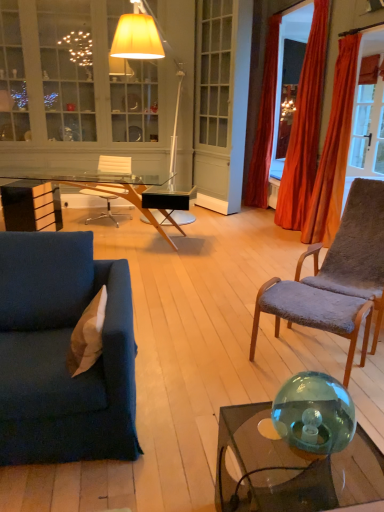
The height and width of the screenshot is (512, 384). Describe the element at coordinates (368, 124) in the screenshot. I see `translucent glass door at upper right` at that location.

The width and height of the screenshot is (384, 512). Describe the element at coordinates (264, 122) in the screenshot. I see `velvet orange curtain at right, positioned as the first curtain in back-to-front order` at that location.

This screenshot has height=512, width=384. In order to click on orange velvet curtain at right, the 3th curtain from the back in this screenshot , I will do `click(334, 150)`.

Can you tell me how much translucent glass door at upper right and orange velvet curtain at right, which is the first curtain in front-to-back order, differ in facing direction?

The angular difference between translucent glass door at upper right and orange velvet curtain at right, which is the first curtain in front-to-back order, is 87.9 degrees.

Looking at this image, between translucent glass door at upper right and orange velvet curtain at right, which is the first curtain in front-to-back order, which one is positioned in front?

orange velvet curtain at right, which is the first curtain in front-to-back order, is closer to the camera.

Considering the sizes of translucent glass door at upper right and orange velvet curtain at right, the 3th curtain from the back, in the image, is translucent glass door at upper right wider or thinner than orange velvet curtain at right, the 3th curtain from the back,?

Clearly, translucent glass door at upper right has less width compared to orange velvet curtain at right, the 3th curtain from the back.

Is orange velvet curtain at right, the 3th curtain from the back, inside translucent glass door at upper right?

That's incorrect, orange velvet curtain at right, the 3th curtain from the back, is not inside translucent glass door at upper right.

From a real-world perspective, is transparent glass desk at center positioned under transparent glass coffee table at lower right based on gravity?

No.

Visually, is transparent glass desk at center positioned to the left or to the right of transparent glass coffee table at lower right?

In the image, transparent glass desk at center appears on the left side of transparent glass coffee table at lower right.

Considering the points (180, 228) and (219, 485), which point is behind, point (180, 228) or point (219, 485)?

The point (180, 228) is more distant.

From the image's perspective, between tan suede pillow at left and clear plastic chair at center, the first chair when ordered from left to right, which one is located above?

clear plastic chair at center, the first chair when ordered from left to right, from the image's perspective.

In the image, is tan suede pillow at left positioned in front of or behind clear plastic chair at center, the second chair from the right?

Clearly, tan suede pillow at left is in front of clear plastic chair at center, the second chair from the right.

Locate an element on the screen. This screenshot has height=512, width=384. chair that is the 2nd one when counting upward from the tan suede pillow at left (from the image's perspective) is located at coordinates (115, 164).

Considering the sizes of objects orange velvet curtain at right, the 3th curtain from the back, and matte white floor lamp at upper center in the image provided, who is shorter, orange velvet curtain at right, the 3th curtain from the back, or matte white floor lamp at upper center?

orange velvet curtain at right, the 3th curtain from the back, is shorter.

Is orange velvet curtain at right, the 3th curtain from the back, wider than matte white floor lamp at upper center?

No.

Which is in front, point (336, 229) or point (177, 98)?

The point (336, 229) is more forward.

Measure the distance between orange velvet curtain at right, the 3th curtain from the back, and matte white floor lamp at upper center.

orange velvet curtain at right, the 3th curtain from the back, and matte white floor lamp at upper center are 2.19 meters apart.

Which object is thinner, transparent glass coffee table at lower right or velvet orange curtain at right, positioned as the first curtain in back-to-front order?

velvet orange curtain at right, positioned as the first curtain in back-to-front order, is thinner.

Which point is more forward, (358,447) or (276,29)?

The point (358,447) is more forward.

Is transparent glass coffee table at lower right touching velvet orange curtain at right, marked as the third curtain in a front-to-back arrangement?

No, transparent glass coffee table at lower right is not making contact with velvet orange curtain at right, marked as the third curtain in a front-to-back arrangement.

Which of these two, transparent glass coffee table at lower right or velvet orange curtain at right, marked as the third curtain in a front-to-back arrangement, is smaller?

With smaller size is transparent glass coffee table at lower right.

Is clear plastic chair at center, the second chair ordered from the bottom, positioned in front of velvet orange curtain at right, positioned as the first curtain in back-to-front order?

Yes, the depth of clear plastic chair at center, the second chair ordered from the bottom, is less than that of velvet orange curtain at right, positioned as the first curtain in back-to-front order.

Can you confirm if clear plastic chair at center, which is the first chair in back-to-front order, is positioned to the right of velvet orange curtain at right, marked as the third curtain in a front-to-back arrangement?

In fact, clear plastic chair at center, which is the first chair in back-to-front order, is to the left of velvet orange curtain at right, marked as the third curtain in a front-to-back arrangement.

What's the angular difference between clear plastic chair at center, the first chair when ordered from left to right, and velvet orange curtain at right, marked as the third curtain in a front-to-back arrangement,'s facing directions?

The angle between the facing direction of clear plastic chair at center, the first chair when ordered from left to right, and the facing direction of velvet orange curtain at right, marked as the third curtain in a front-to-back arrangement, is 64.5 degrees.

Which of these two, clear plastic chair at center, arranged as the 2th chair when viewed from the front, or velvet orange curtain at right, positioned as the first curtain in back-to-front order, stands shorter?

clear plastic chair at center, arranged as the 2th chair when viewed from the front, is shorter.

From the image's perspective, is clear plastic chair at center, the second chair from the right, below velvet blue couch at lower left?

No.

From a real-world perspective, does clear plastic chair at center, the second chair ordered from the bottom, sit lower than velvet blue couch at lower left?

Actually, clear plastic chair at center, the second chair ordered from the bottom, is physically above velvet blue couch at lower left in the real world.

Looking at their sizes, would you say clear plastic chair at center, the second chair from the right, is wider or thinner than velvet blue couch at lower left?

Clearly, clear plastic chair at center, the second chair from the right, has less width compared to velvet blue couch at lower left.

Image resolution: width=384 pixels, height=512 pixels. Identify the location of curtain lying below the translucent glass door at upper right (from the image's perspective). (334, 150).

What are the coordinates of `coffee table in front of the transparent glass desk at center` in the screenshot? It's located at (290, 469).

Which object lies nearer to the anchor point gray plush chair at right, positioned as the second chair in back-to-front order, matte white floor lamp at upper center or transparent glass sphere at lower right?

transparent glass sphere at lower right is closer to gray plush chair at right, positioned as the second chair in back-to-front order.

Considering their positions, is clear plastic chair at center, the first chair when ordered from left to right, positioned closer to transparent glass desk at center than orange velvet curtain at right, arranged as the second curtain when viewed from the back?

The object closer to transparent glass desk at center is clear plastic chair at center, the first chair when ordered from left to right.

Estimate the real-world distances between objects in this image. Which object is further from matte white cabinet at upper left, transparent glass desk at center or orange velvet curtain at right, arranged as the second curtain when viewed from the front?

Based on the image, orange velvet curtain at right, arranged as the second curtain when viewed from the front, appears to be further to matte white cabinet at upper left.

From the image, which object appears to be nearer to matte white cabinet at upper left, velvet orange curtain at right, marked as the third curtain in a front-to-back arrangement, or tan suede pillow at left?

The object closer to matte white cabinet at upper left is velvet orange curtain at right, marked as the third curtain in a front-to-back arrangement.

When comparing their distances from velvet blue couch at lower left, does orange velvet curtain at right, the 3th curtain from the back, or clear plastic chair at center, the second chair from the right, seem closer?

Based on the image, orange velvet curtain at right, the 3th curtain from the back, appears to be nearer to velvet blue couch at lower left.

Based on their spatial positions, is gray plush chair at right, which is the 1th chair from front to back, or velvet blue couch at lower left further from clear plastic chair at center, which is the first chair in top-to-bottom order?

The object further to clear plastic chair at center, which is the first chair in top-to-bottom order, is velvet blue couch at lower left.

Based on their spatial positions, is velvet blue couch at lower left or clear plastic chair at center, the second chair ordered from the bottom, further from velvet orange curtain at right, positioned as the first curtain in back-to-front order?

velvet blue couch at lower left is positioned further to the anchor velvet orange curtain at right, positioned as the first curtain in back-to-front order.

When comparing their distances from translucent glass door at upper right, does orange velvet curtain at right, arranged as the second curtain when viewed from the back, or clear plastic chair at center, which is the first chair in back-to-front order, seem further?

clear plastic chair at center, which is the first chair in back-to-front order, is further to translucent glass door at upper right.

Where is `desk between transparent glass sphere at lower right and velvet orange curtain at right, positioned as the first curtain in back-to-front order, along the z-axis`? The image size is (384, 512). desk between transparent glass sphere at lower right and velvet orange curtain at right, positioned as the first curtain in back-to-front order, along the z-axis is located at coordinates (117, 190).

Where is `lamp between gray plush chair at right, which appears as the 1th chair when viewed from the right, and velvet orange curtain at right, marked as the third curtain in a front-to-back arrangement, along the z-axis`? The image size is (384, 512). lamp between gray plush chair at right, which appears as the 1th chair when viewed from the right, and velvet orange curtain at right, marked as the third curtain in a front-to-back arrangement, along the z-axis is located at coordinates 137,36.

The width and height of the screenshot is (384, 512). Identify the location of chair between matte white cabinet at upper left and velvet orange curtain at right, positioned as the first curtain in back-to-front order, from left to right. (115, 164).

What are the coordinates of `lamp between velvet blue couch at lower left and transparent glass desk at center along the z-axis` in the screenshot? It's located at [x=137, y=36].